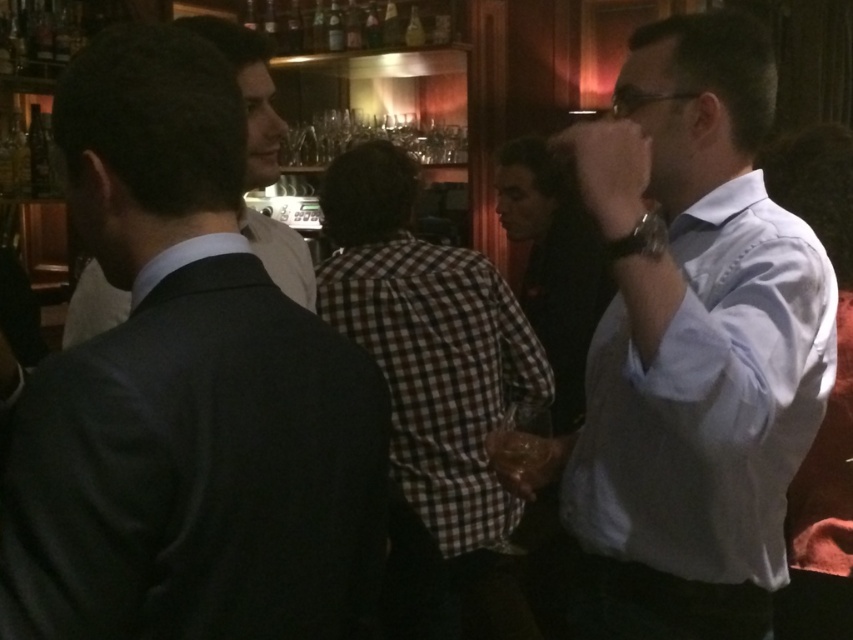
You are a photographer at the event and want to capture a photo of the dark gray suit at left. Where should you position your camera to ensure the suit is in the frame?

The dark gray suit at left is located at point (186, 394), so positioning the camera to face that coordinate will ensure the suit is centered in the frame.

You are a photographer at this event and want to capture both the light blue shirt at right and the checkered fabric shirt at center in your photo. However, your camera can only focus on one subject at a time. Which shirt should you focus on to ensure the other remains in the background?

You should focus on the light blue shirt at right because it is in front of the checkered fabric shirt at center, so the checkered fabric shirt at center will naturally be in the background if the light blue shirt at right is in focus.